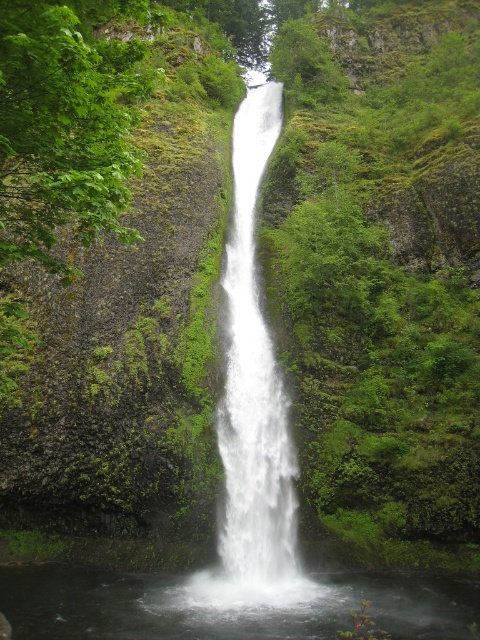
You are a photographer planning to capture the waterfall and the pool below. You have a camera with a wide angle lens that can capture a maximum width of 10 meters. Given the clear water at center and white smooth waterfall at center, which of these two features will require a wider frame to fit entirely in your photo?

The clear water at center has a greater width than the white smooth waterfall at center, so the clear water at center will require a wider frame to fit entirely in the photo.

You are standing at the edge of the cliff overlooking the waterfall. There is a point marked at coordinates (228,605) in the scene. According to the image, what does this point represent?

The point at (228,605) corresponds to clear water at center.